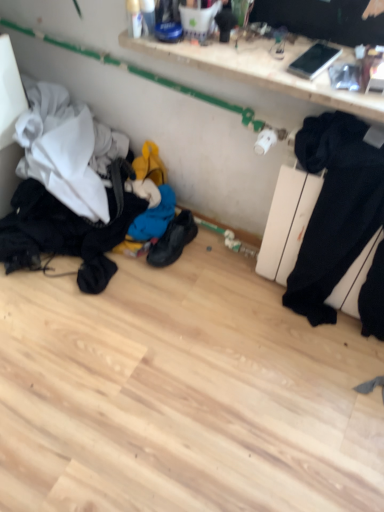
What is the approximate width of black leather shoes at center?

black leather shoes at center is 10.95 inches wide.

Where is `black matte sweat pants at right`? The height and width of the screenshot is (512, 384). black matte sweat pants at right is located at coordinates (335, 209).

This screenshot has width=384, height=512. I want to click on black leather shoes at center, so click(173, 240).

What's the angular difference between black leather shoes at center and white glossy shelf at upper center's facing directions?

They differ by 0.396 degrees in their facing directions.

Consider the image. Is there a large distance between black leather shoes at center and white glossy shelf at upper center?

That's not correct — black leather shoes at center is a little close to white glossy shelf at upper center.

Is black leather shoes at center aimed at white glossy shelf at upper center?

No, black leather shoes at center is not turned towards white glossy shelf at upper center.

Considering the positions of objects black leather shoes at center and white glossy shelf at upper center in the image provided, who is behind, black leather shoes at center or white glossy shelf at upper center?

black leather shoes at center is further from the camera.

Is black fabric laundry at lower left placed right next to black matte sweat pants at right?

No, black fabric laundry at lower left is not with black matte sweat pants at right.

Who is smaller, black fabric laundry at lower left or black matte sweat pants at right?

Smaller between the two is black matte sweat pants at right.

From a real-world perspective, which object rests below the other?

black fabric laundry at lower left is physically lower.

Is black fabric laundry at lower left not within black matte sweat pants at right?

Indeed, black fabric laundry at lower left is completely outside black matte sweat pants at right.

Is black leather shoes at center at the right side of black matte sweat pants at right?

Incorrect, black leather shoes at center is not on the right side of black matte sweat pants at right.

From the image's perspective, is black leather shoes at center located above or below black matte sweat pants at right?

Clearly, from the image's perspective, black leather shoes at center is below black matte sweat pants at right.

Can you confirm if black leather shoes at center is taller than black matte sweat pants at right?

Incorrect, the height of black leather shoes at center is not larger of that of black matte sweat pants at right.

From the image's perspective, which is below, black fabric laundry at lower left or white glossy shelf at upper center?

black fabric laundry at lower left is shown below in the image.

Are black fabric laundry at lower left and white glossy shelf at upper center far apart?

No.

This screenshot has width=384, height=512. In the image, there is a white glossy shelf at upper center. Identify the location of laundry below it (from the image's perspective). (83, 194).

From a real-world perspective, is black fabric laundry at lower left below white glossy shelf at upper center?

Correct, in the physical world, black fabric laundry at lower left is lower than white glossy shelf at upper center.

Considering the positions of objects black matte sweat pants at right and white glossy shelf at upper center in the image provided, who is more to the left, black matte sweat pants at right or white glossy shelf at upper center?

white glossy shelf at upper center is more to the left.

Can you tell me how much black matte sweat pants at right and white glossy shelf at upper center differ in facing direction?

They differ by 0.9 degrees in their facing directions.

From the image's perspective, is black matte sweat pants at right over white glossy shelf at upper center?

No.

Looking at this image, can you confirm if black matte sweat pants at right is smaller than white glossy shelf at upper center?

No, black matte sweat pants at right is not smaller than white glossy shelf at upper center.

From a real-world perspective, which is physically above, black matte sweat pants at right or black fabric laundry at lower left?

black matte sweat pants at right is physically above.

Consider the image. Can you confirm if black matte sweat pants at right is shorter than black fabric laundry at lower left?

No.

Is point (304, 270) less distant than point (60, 212)?

Yes, point (304, 270) is in front of point (60, 212).

Considering the sizes of objects black matte sweat pants at right and black fabric laundry at lower left in the image provided, who is bigger, black matte sweat pants at right or black fabric laundry at lower left?

Bigger between the two is black fabric laundry at lower left.

From the image's perspective, is black leather shoes at center positioned above or below black fabric laundry at lower left?

Based on their image positions, black leather shoes at center is located beneath black fabric laundry at lower left.

Is black leather shoes at center positioned with its back to black fabric laundry at lower left?

No.

Considering the sizes of objects black leather shoes at center and black fabric laundry at lower left in the image provided, who is bigger, black leather shoes at center or black fabric laundry at lower left?

With larger size is black fabric laundry at lower left.

Do you think black leather shoes at center is within black fabric laundry at lower left, or outside of it?

black leather shoes at center is not inside black fabric laundry at lower left, it's outside.

Locate an element on the screen. shelf above the black leather shoes at center (from a real-world perspective) is located at coordinates (262, 71).

Locate an element on the screen. This screenshot has height=512, width=384. sweat pant on the right of black fabric laundry at lower left is located at coordinates (335, 209).

Which object lies further to the anchor point black leather shoes at center, black matte sweat pants at right or white glossy shelf at upper center?

white glossy shelf at upper center is further to black leather shoes at center.

Estimate the real-world distances between objects in this image. Which object is further from white glossy shelf at upper center, black leather shoes at center or black fabric laundry at lower left?

black leather shoes at center is further to white glossy shelf at upper center.

Looking at the image, which one is located closer to black leather shoes at center, black fabric laundry at lower left or white glossy shelf at upper center?

Based on the image, black fabric laundry at lower left appears to be nearer to black leather shoes at center.

When comparing their distances from black matte sweat pants at right, does black leather shoes at center or black fabric laundry at lower left seem further?

Among the two, black fabric laundry at lower left is located further to black matte sweat pants at right.

Consider the image. Which object lies further to the anchor point white glossy shelf at upper center, black matte sweat pants at right or black leather shoes at center?

The object further to white glossy shelf at upper center is black leather shoes at center.

Which object lies nearer to the anchor point black leather shoes at center, black matte sweat pants at right or black fabric laundry at lower left?

black fabric laundry at lower left lies closer to black leather shoes at center than the other object.

From the picture: Looking at the image, which one is located closer to black fabric laundry at lower left, white glossy shelf at upper center or black leather shoes at center?

black leather shoes at center lies closer to black fabric laundry at lower left than the other object.

From the image, which object appears to be nearer to black matte sweat pants at right, black fabric laundry at lower left or black leather shoes at center?

black leather shoes at center is closer to black matte sweat pants at right.

At what (x,y) coordinates should I click in order to perform the action: click on shelf situated between black fabric laundry at lower left and black matte sweat pants at right from left to right. Please return your answer as a coordinate pair (x, y). Looking at the image, I should click on (262, 71).

Find the location of a particular element. This screenshot has width=384, height=512. footwear between black fabric laundry at lower left and white glossy shelf at upper center from left to right is located at coordinates (173, 240).

The height and width of the screenshot is (512, 384). What are the coordinates of `footwear located between black fabric laundry at lower left and black matte sweat pants at right in the left-right direction` in the screenshot? It's located at (173, 240).

The image size is (384, 512). Find the location of `sweat pant between white glossy shelf at upper center and black leather shoes at center in the vertical direction`. sweat pant between white glossy shelf at upper center and black leather shoes at center in the vertical direction is located at coordinates (335, 209).